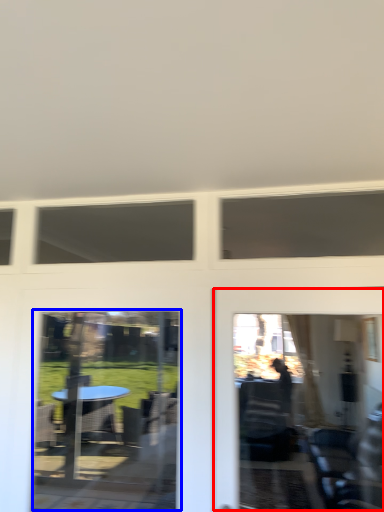
Question: Which point is closer to the camera, garage door (highlighted by a red box) or screen door (highlighted by a blue box)?

Choices:
 (A) garage door
 (B) screen door

Answer: (A)